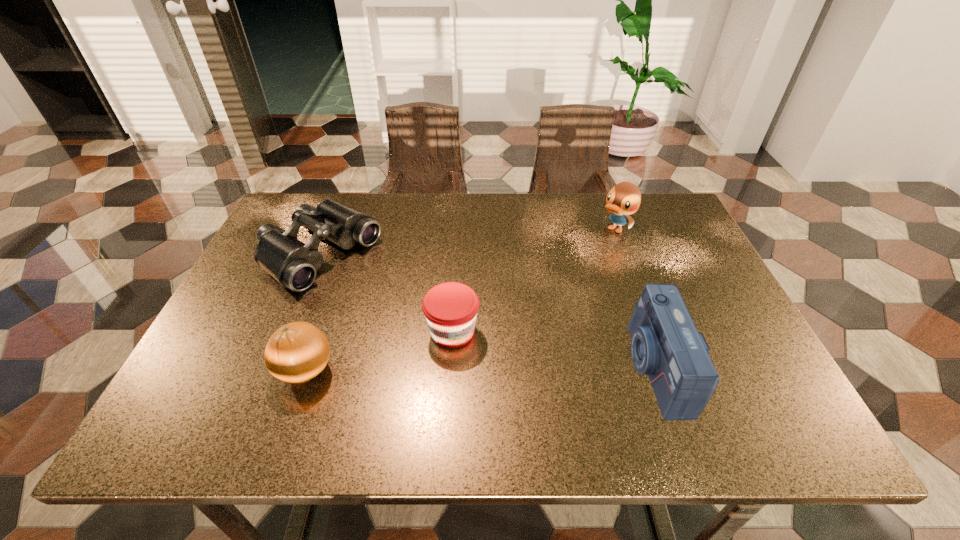
Image resolution: width=960 pixels, height=540 pixels. I want to click on vacant space on the desktop that is between the orange and the camera and is positioned on the front-facing side of the binoculars, so click(x=505, y=368).

Locate an element on the screen. Image resolution: width=960 pixels, height=540 pixels. free spot on the desktop that is between the orange and the camera and is positioned on the label side of the shortest object is located at coordinates (531, 368).

Where is `vacant space on the desktop that is between the orange and the camera and is positioned on the front-facing side of the duck`? The height and width of the screenshot is (540, 960). vacant space on the desktop that is between the orange and the camera and is positioned on the front-facing side of the duck is located at coordinates (449, 369).